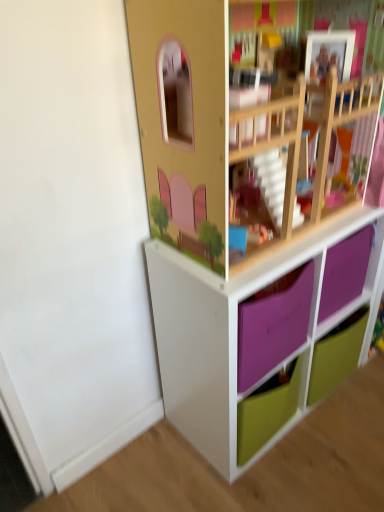
Where is `vacant space to the right of green matte drawer at lower right`? vacant space to the right of green matte drawer at lower right is located at coordinates (367, 382).